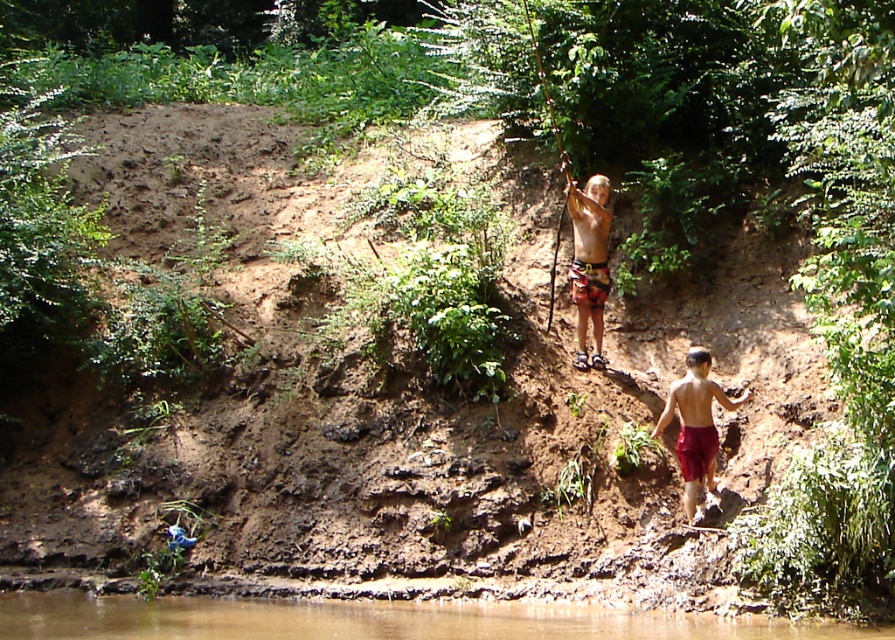
Is brown muddy water at lower center positioned behind red cotton shorts at lower right?

No, it is not.

Which is behind, point (629, 628) or point (667, 397)?

Positioned behind is point (667, 397).

Where is `brown muddy water at lower center`? Image resolution: width=895 pixels, height=640 pixels. brown muddy water at lower center is located at coordinates (372, 620).

Between point (593, 216) and point (672, 394), which one is positioned in front?

Positioned in front is point (672, 394).

Identify the location of multicolored shorts at center. (589, 262).

Is brown muddy water at lower center closer to the viewer compared to multicolored shorts at center?

Yes, it is in front of multicolored shorts at center.

Is brown muddy water at lower center above multicolored shorts at center?

No, brown muddy water at lower center is not above multicolored shorts at center.

Who is more forward, (432, 609) or (603, 273)?

Point (432, 609)

At what (x,y) coordinates should I click in order to perform the action: click on brown muddy water at lower center. Please return your answer as a coordinate pair (x, y). The width and height of the screenshot is (895, 640). Looking at the image, I should click on (372, 620).